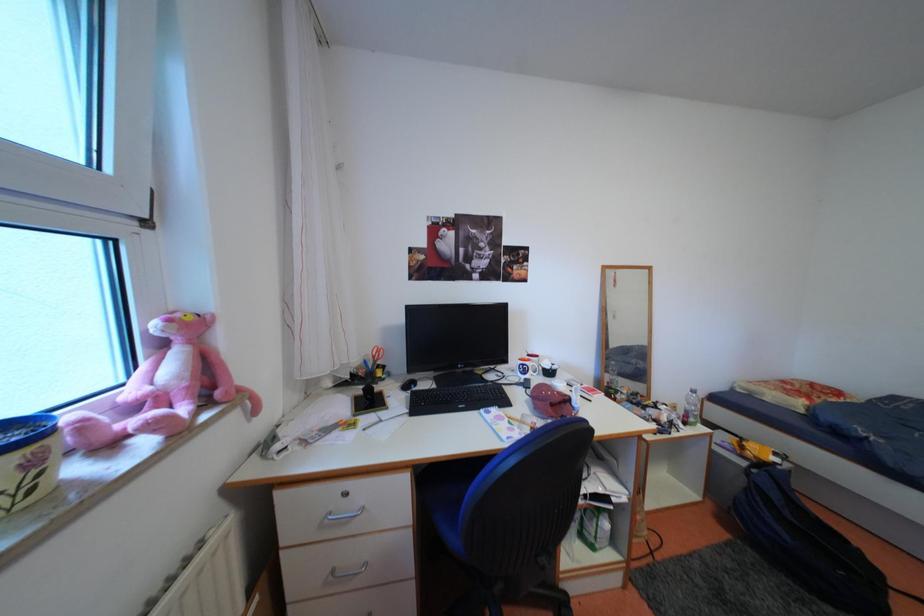
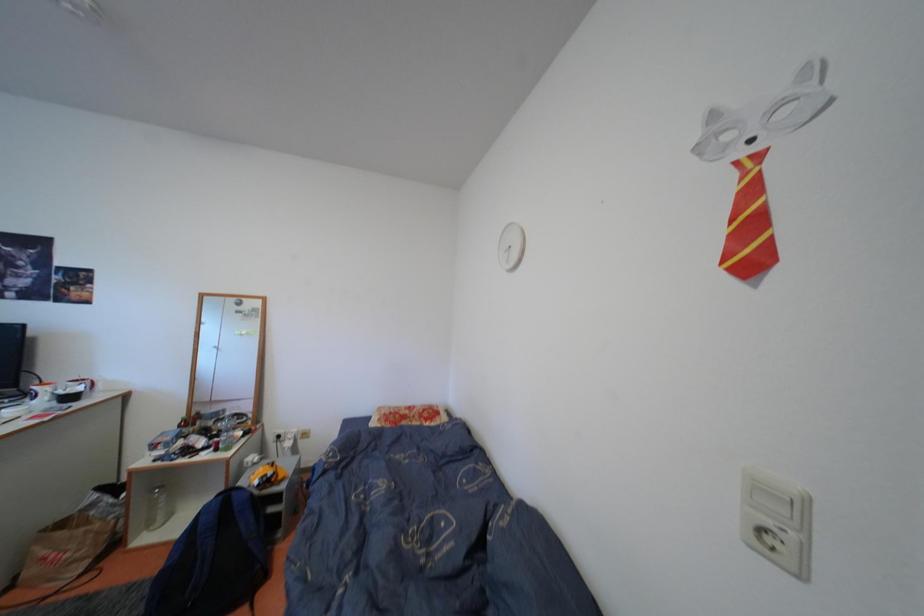
Question: Which direction would the cameraman need to move to produce the second image? Reply with the corresponding letter.

Choices:
 (A) Left
 (B) Right
 (C) Forward
 (D) Backward

Answer: (B)